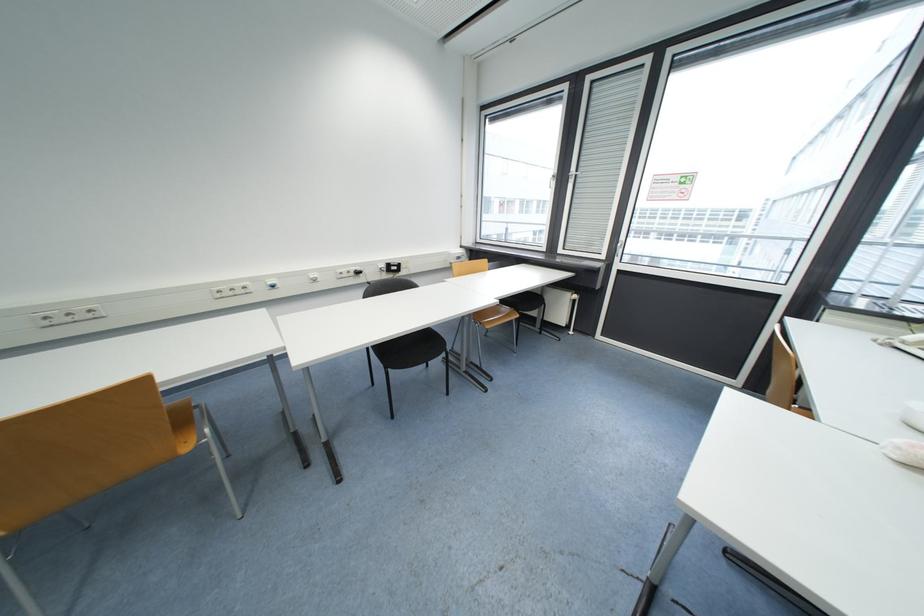
Identify the location of telephone handset. (910, 344).